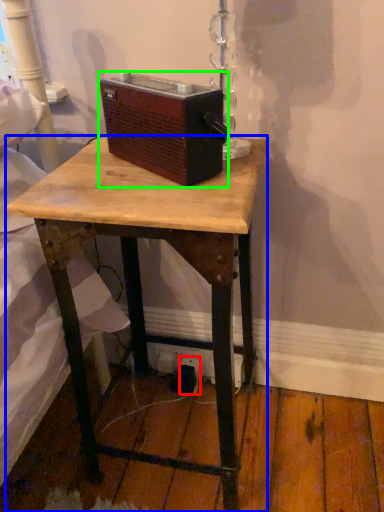
Question: Estimate the real-world distances between objects in this image. Which object is farther from electric outlet (highlighted by a red box), desk (highlighted by a blue box) or gadget (highlighted by a green box)?

Choices:
 (A) desk
 (B) gadget

Answer: (B)